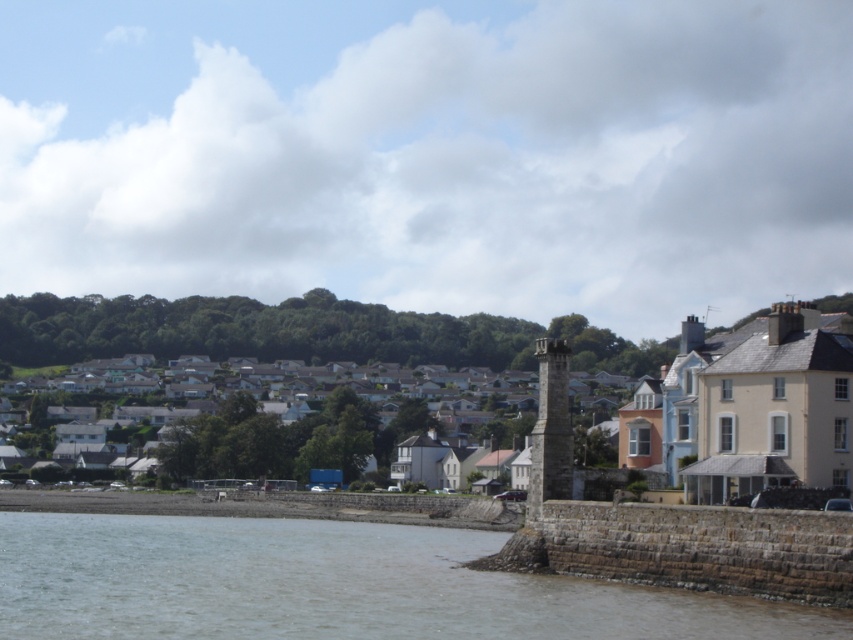
Does brown stone wall at lower left have a lesser width compared to white matte houses at center?

Yes, brown stone wall at lower left is thinner than white matte houses at center.

Between brown stone wall at lower left and white matte houses at center, which one is positioned higher?

Positioned higher is white matte houses at center.

Who is more forward, (x=509, y=577) or (x=732, y=326)?

Point (x=509, y=577) is more forward.

You are a GUI agent. You are given a task and a screenshot of the screen. Output one action in this format:
    pyautogui.click(x=<x>, y=<y>)
    Task: Click on the brown stone wall at lower left
    Image resolution: width=853 pixels, height=640 pixels.
    Given the screenshot: What is the action you would take?
    pyautogui.click(x=332, y=586)